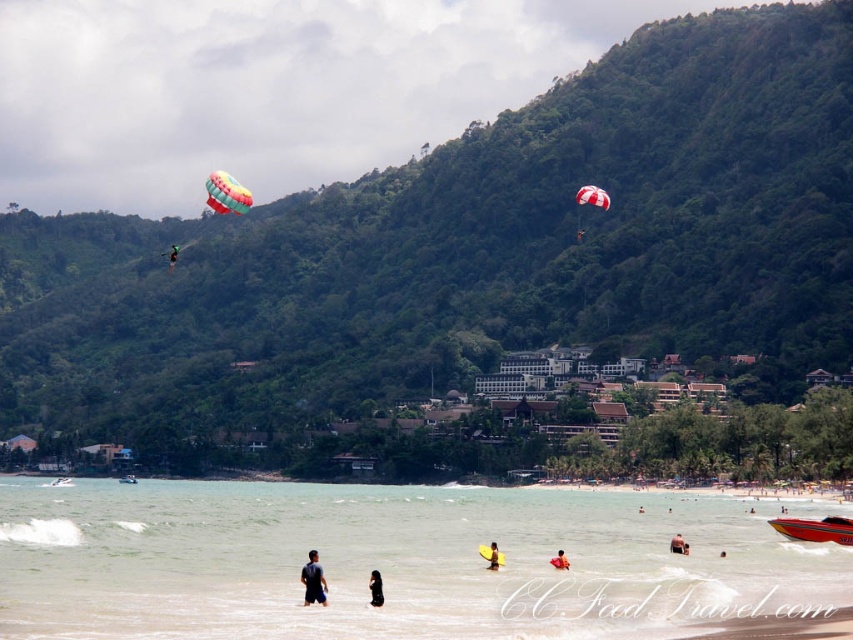
Based on the photo, you are a photographer trying to capture the scene. You need to focus on the dark blue fabric shirt at lower center and the green fabric parachute at upper left. Which object is wider in the image?

The dark blue fabric shirt at lower center has a lesser width compared to the green fabric parachute at upper left, so the green fabric parachute at upper left is wider.

You are standing on the beach and see the clear water at lower center and the yellow foam board at lower center. Which one is wider?

The clear water at lower center might be wider than yellow foam board at lower center.

You are standing at the beach and want to walk towards the two points marked in the image. Which point, point (630, 588) or point (498, 566), would you reach first?

Point (630, 588) is closer to the viewer than point (498, 566), so you would reach point (630, 588) first.